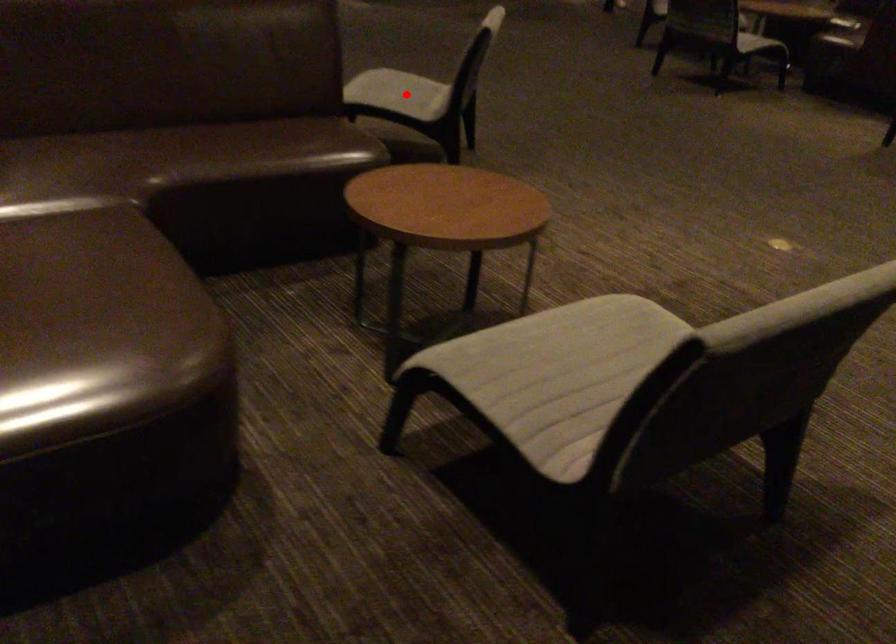
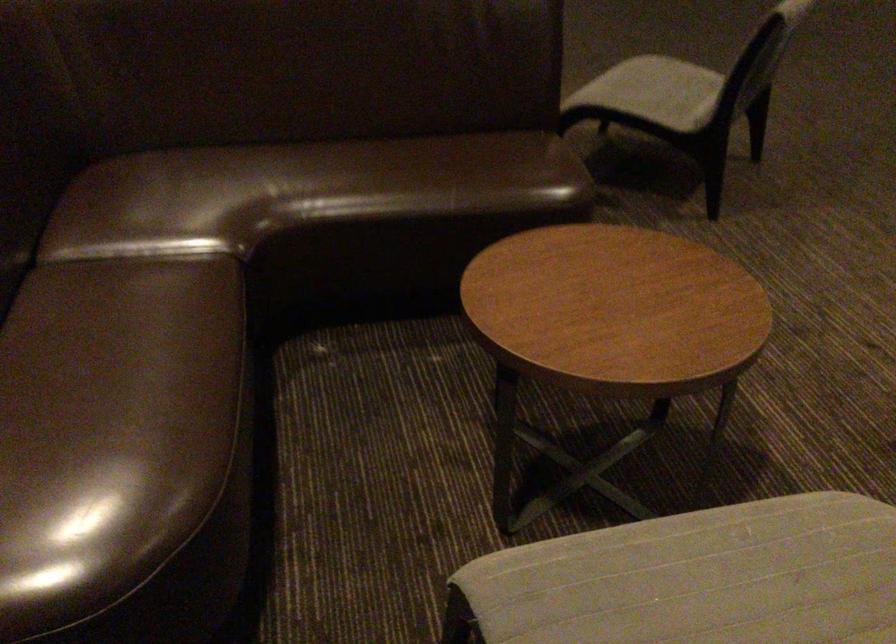
Question: I am providing you with two images of the same scene from different viewpoints. A red point is shown in image1. For the corresponding object point in image2, is it positioned nearer or farther from the camera?

Choices:
 (A) Nearer
 (B) Farther

Answer: (A)